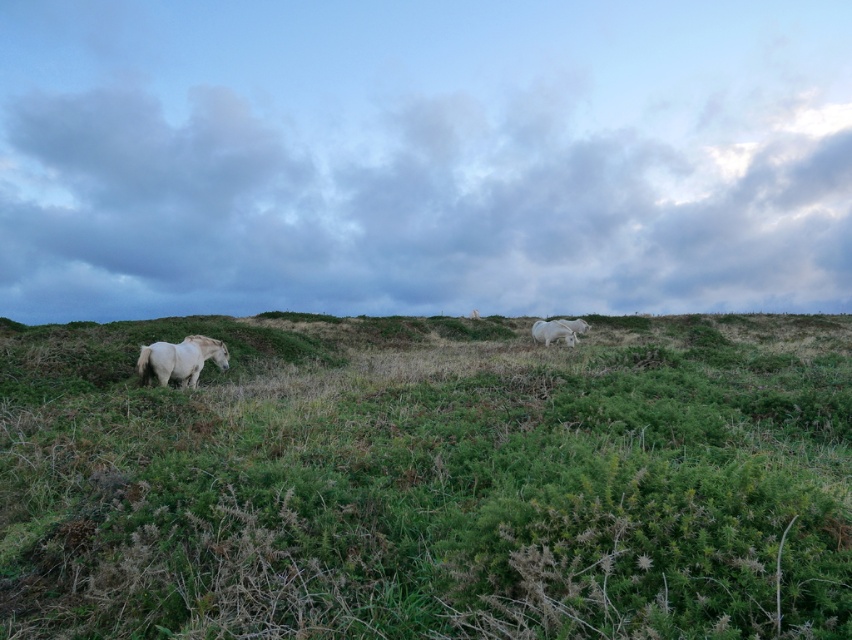
You are a photographer planning to take a photo of the green grassy at center and the white matte horse at left. Based on their sizes in the image, which one would appear more prominent in the photo?

The green grassy at center would appear more prominent in the photo because it is larger in size than the white matte horse at left.

Consider the image. You are a photographer standing at the base of the hill. You want to take a photo that includes both the white matte horse at left and the white matte horse at upper center. Which horse should you position closer to the left edge of your camera frame to ensure both are visible?

You should position the white matte horse at left closer to the left edge of your camera frame because it is already to the left of the white matte horse at upper center, ensuring both are visible in the frame.

You are standing at the point marked by the coordinate point at (179, 358) in the image. Looking around, you see a white matte horse at left. Which direction should you walk to reach the white matte horse at left?

The point at (179, 358) is on the white matte horse at left, so you are already at the white matte horse at left and do not need to move.